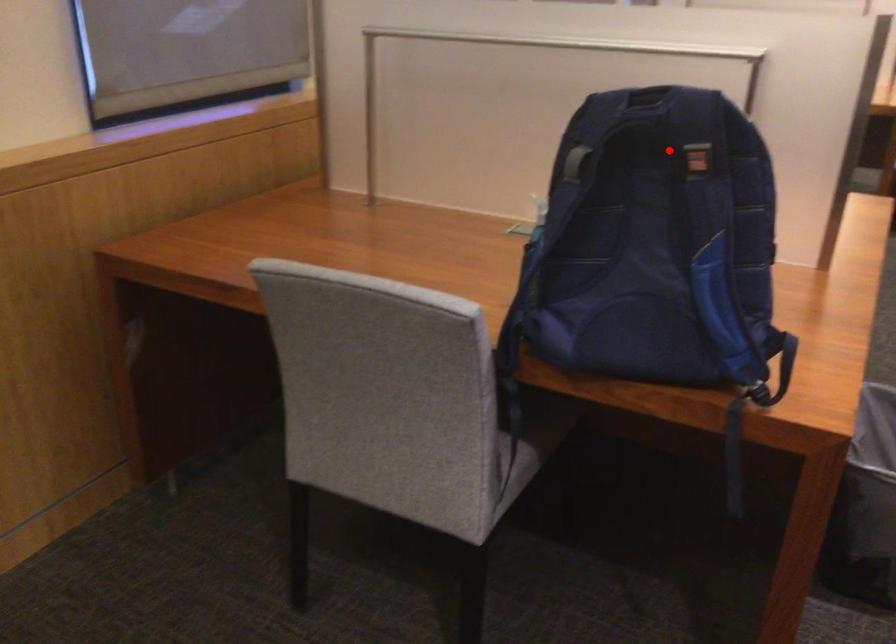
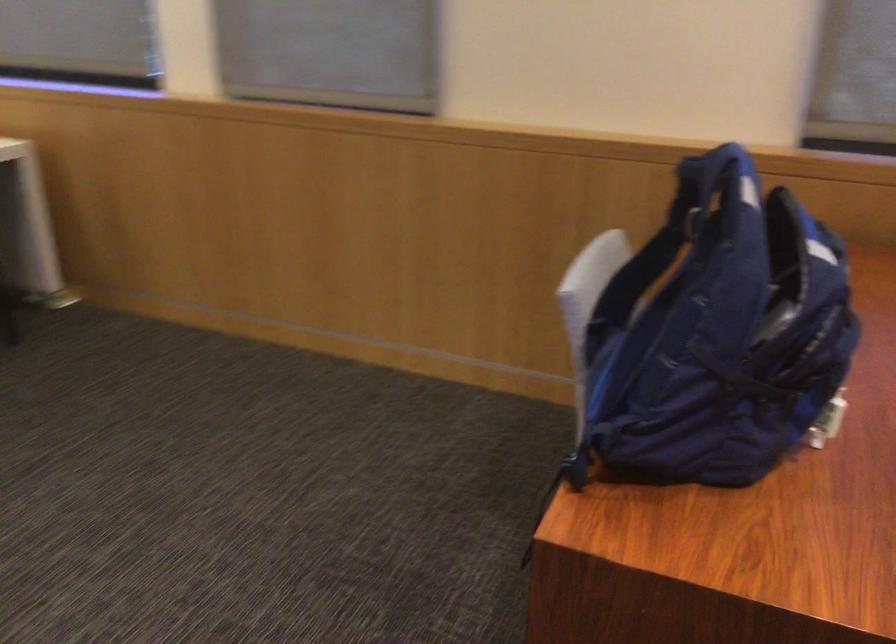
Question: I am providing you with two images of the same scene from different viewpoints. A red point is shown in image1. For the corresponding object point in image2, is it positioned nearer or farther from the camera?

Choices:
 (A) Nearer
 (B) Farther

Answer: (A)